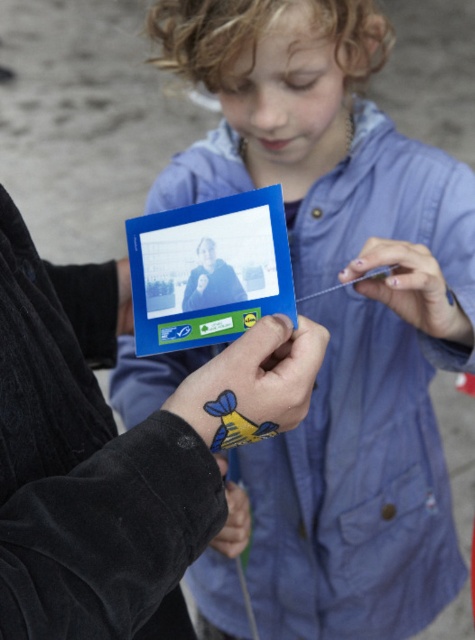
Question: Does blue plastic card at center appear on the left side of nail polish at center?

Choices:
 (A) no
 (B) yes

Answer: (B)

Question: In this image, where is blue plastic card at center located relative to matte plastic photo frame at center?

Choices:
 (A) left
 (B) right

Answer: (A)

Question: Among these objects, which one is nearest to the camera?

Choices:
 (A) blue plastic card at center
 (B) nail polish at center
 (C) matte plastic photo frame at center
 (D) matte blue card at center

Answer: (A)

Question: Which point is closer to the camera?

Choices:
 (A) blue tattooed hand at center
 (B) matte plastic photo frame at center

Answer: (A)

Question: Among these objects, which one is farthest from the camera?

Choices:
 (A) matte blue card at center
 (B) black matte hand at center
 (C) nail polish at center

Answer: (B)

Question: Is nail polish at center further to the viewer compared to matte plastic photo frame at center?

Choices:
 (A) yes
 (B) no

Answer: (A)